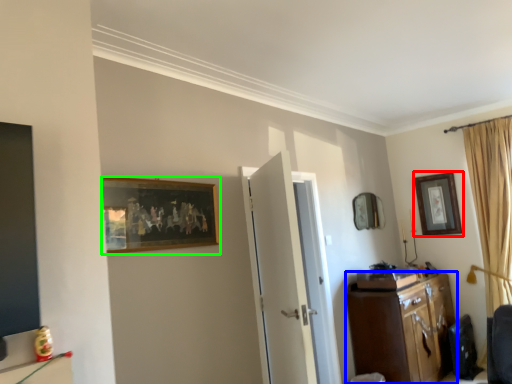
Question: Considering the real-world distances, which object is closest to picture frame (highlighted by a red box)? cabinetry (highlighted by a blue box) or picture frame (highlighted by a green box).

Choices:
 (A) cabinetry
 (B) picture frame

Answer: (A)